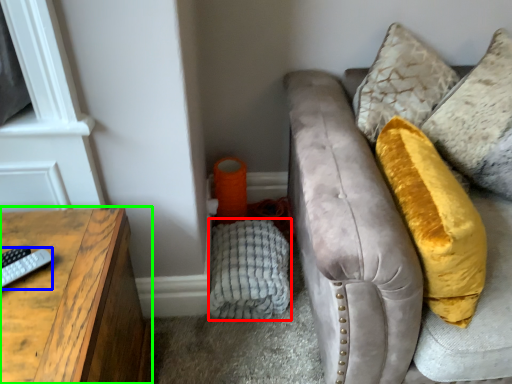
Question: Considering the real-world distances, which object is farthest from material (highlighted by a red box)? remote (highlighted by a blue box) or table (highlighted by a green box)?

Choices:
 (A) remote
 (B) table

Answer: (A)